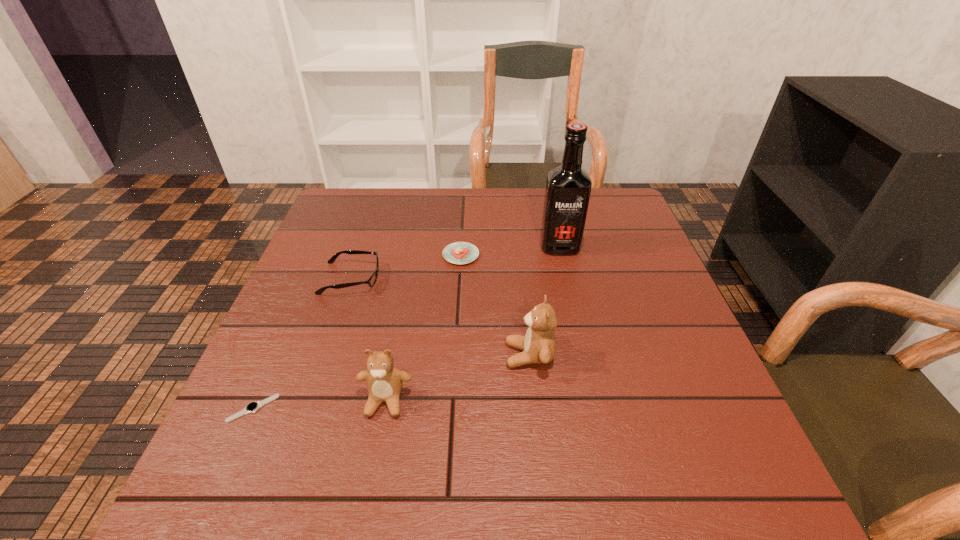
Identify the location of free space between the shortest object and the fifth tallest object. The width and height of the screenshot is (960, 540). (357, 332).

Image resolution: width=960 pixels, height=540 pixels. I want to click on unoccupied position between the fifth tallest object and the shortest object, so click(357, 332).

The image size is (960, 540). I want to click on empty space that is in between the watch and the nearer teddy bear, so click(320, 404).

You are a GUI agent. You are given a task and a screenshot of the screen. Output one action in this format:
    pyautogui.click(x=<x>, y=<y>)
    Task: Click on the vacant area that lies between the pastry and the second tallest object
    This screenshot has height=540, width=960.
    Given the screenshot: What is the action you would take?
    pyautogui.click(x=495, y=305)

Locate an element on the screen. Image resolution: width=960 pixels, height=540 pixels. unoccupied position between the third shortest object and the shorter teddy bear is located at coordinates (368, 340).

You are a GUI agent. You are given a task and a screenshot of the screen. Output one action in this format:
    pyautogui.click(x=<x>, y=<y>)
    Task: Click on the free spot between the pastry and the fourth object from right to left
    The width and height of the screenshot is (960, 540).
    Given the screenshot: What is the action you would take?
    pyautogui.click(x=423, y=328)

Find the location of a particular element. free area in between the pastry and the tallest object is located at coordinates (511, 251).

At what (x,y) coordinates should I click in order to perform the action: click on empty space between the shortest object and the fourth shortest object. Please return your answer as a coordinate pair (x, y). Image resolution: width=960 pixels, height=540 pixels. Looking at the image, I should click on (320, 404).

Locate an element on the screen. object that is the third closest to the fifth tallest object is located at coordinates pyautogui.click(x=538, y=345).

Identify which object is located as the third nearest to the fifth object from left to right. Please provide its 2D coordinates. Your answer should be formatted as a tuple, i.e. [(x, y)], where the tuple contains the x and y coordinates of a point satisfying the conditions above.

[(568, 187)]